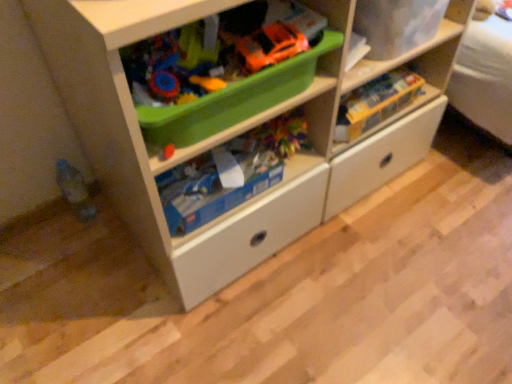
This screenshot has height=384, width=512. What are the coordinates of `free space between matte plastic toy at lower left, the third toy from the right, and white matte chest of drawers at center` in the screenshot? It's located at (119, 244).